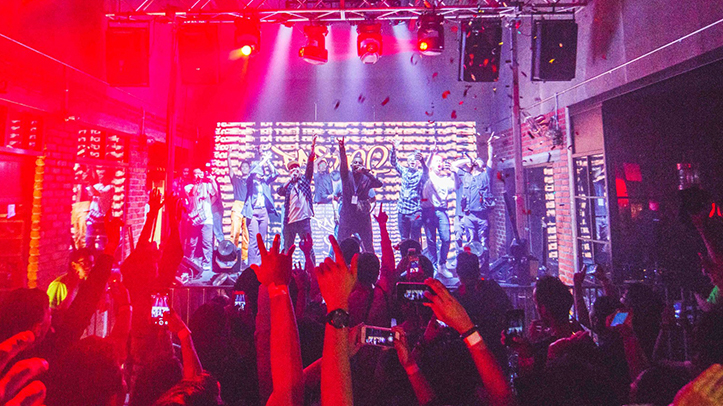
Locate an element on the screen. The height and width of the screenshot is (406, 723). brick wall is located at coordinates (562, 179).